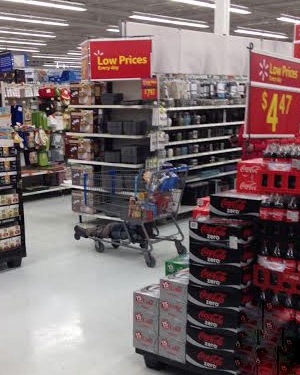
Identify the location of oven glove. (45, 136).